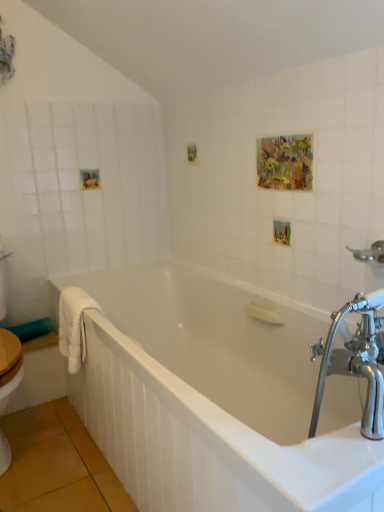
Question: From a real-world perspective, is chrome metallic showerhead at upper right physically located above or below white glossy bathtub at center?

Choices:
 (A) above
 (B) below

Answer: (A)

Question: In the image, is chrome metallic showerhead at upper right on the left side or the right side of white glossy bathtub at center?

Choices:
 (A) left
 (B) right

Answer: (B)

Question: Which object is the farthest from the white fluffy towel at left?

Choices:
 (A) white glossy bathtub at center
 (B) chrome metallic showerhead at upper right

Answer: (B)

Question: Based on their relative distances, which object is farther from the white glossy bathtub at center?

Choices:
 (A) chrome metallic showerhead at upper right
 (B) white fluffy towel at left

Answer: (A)